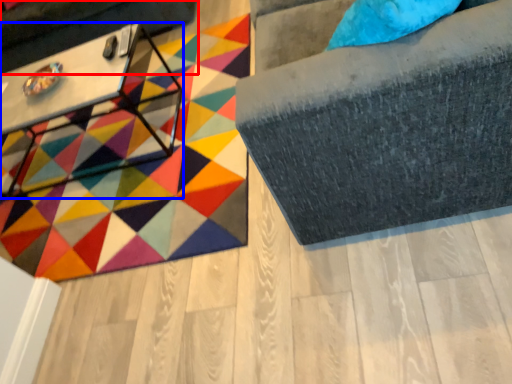
Question: Which point is further to the camera, swivel chair (highlighted by a red box) or table (highlighted by a blue box)?

Choices:
 (A) swivel chair
 (B) table

Answer: (A)